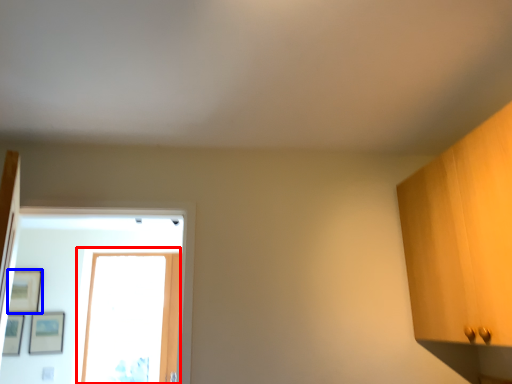
Question: Which object appears farthest to the camera in this image, glass door (highlighted by a red box) or picture frame (highlighted by a blue box)?

Choices:
 (A) glass door
 (B) picture frame

Answer: (A)